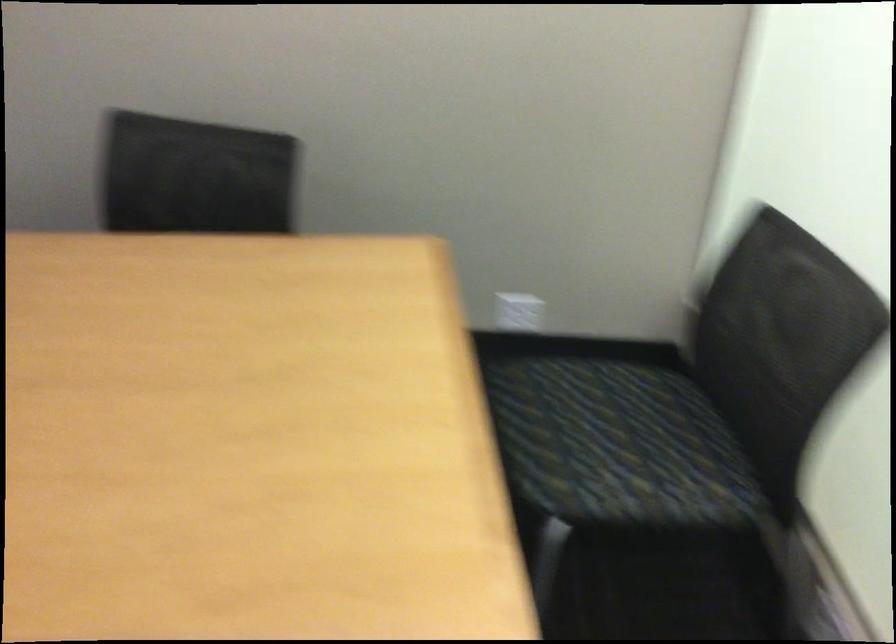
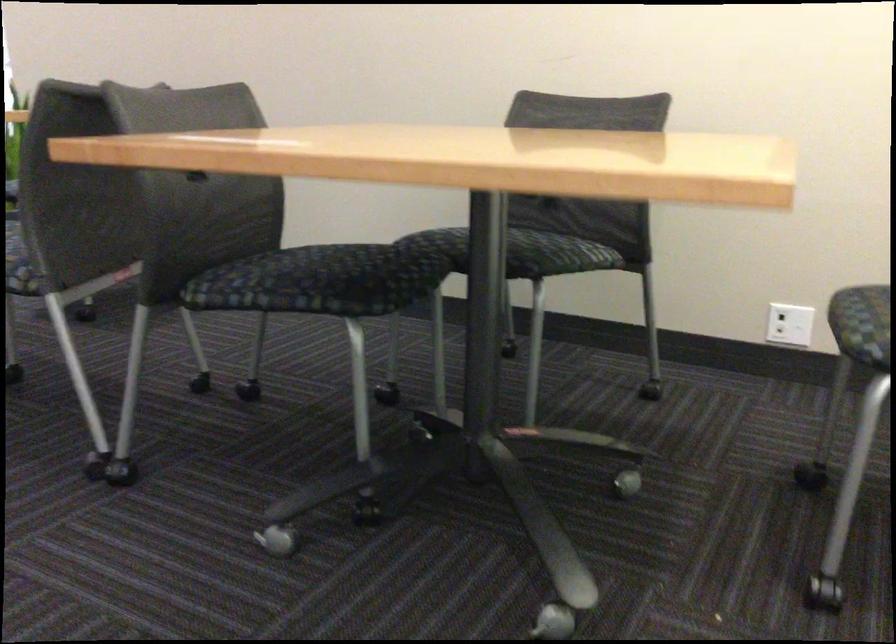
Where in the second image is the point corresponding to the point at 537,453 from the first image?

(862, 324)